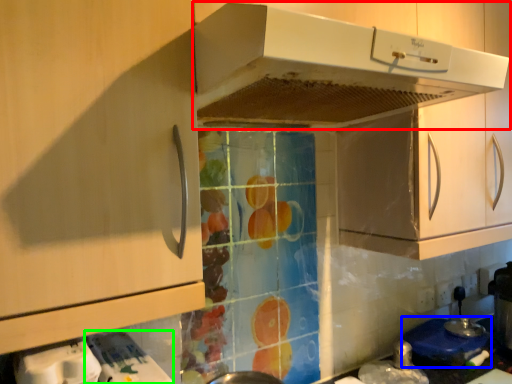
Question: Which object is the closest to the home appliance (highlighted by a red box)? Choose among these: appliance (highlighted by a blue box) or appliance (highlighted by a green box).

Choices:
 (A) appliance
 (B) appliance

Answer: (B)